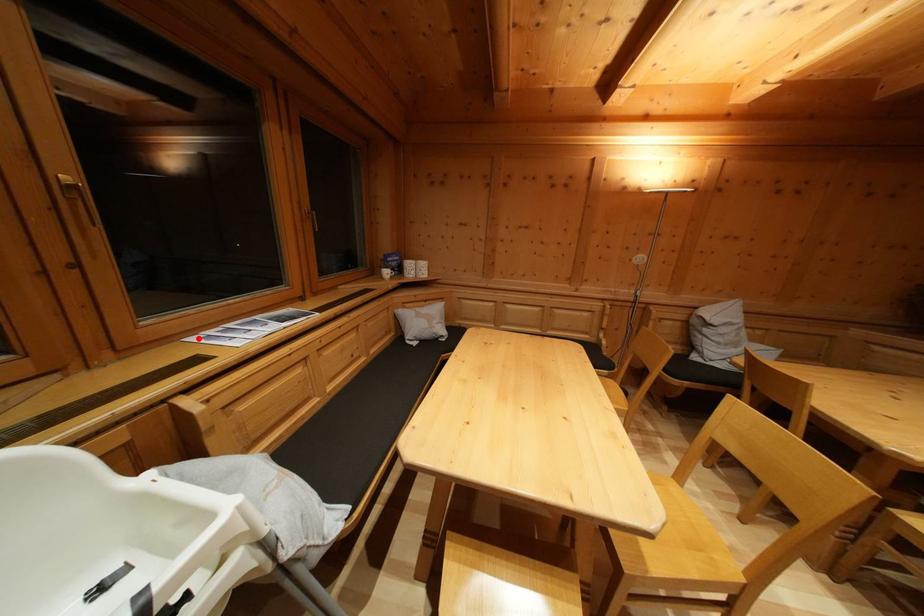
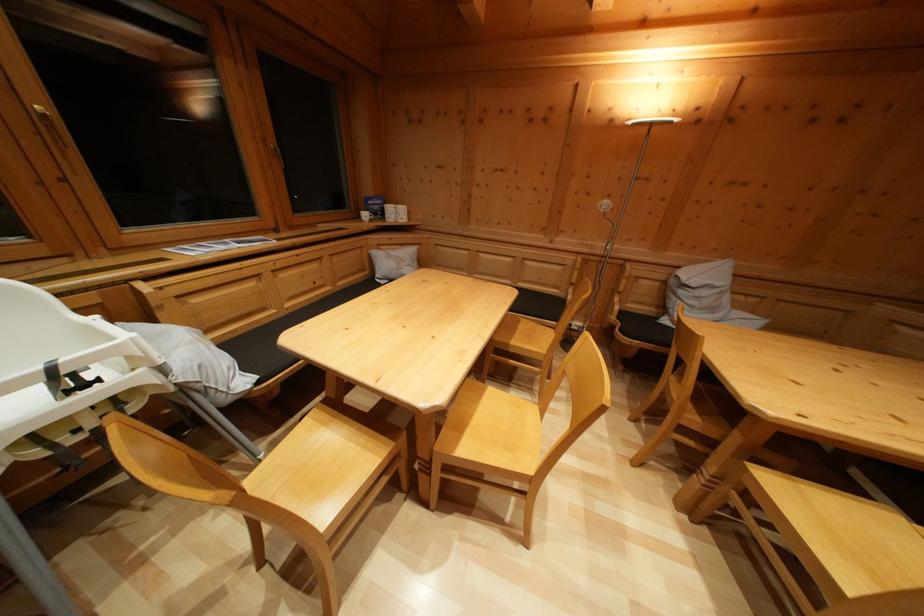
In the second image, find the point that corresponds to the highlighted location in the first image.

(176, 251)